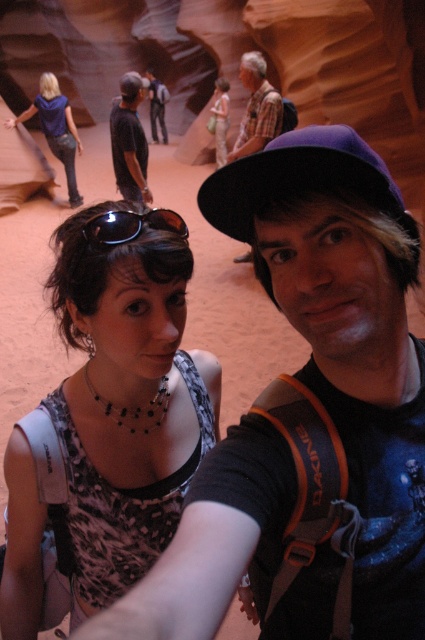
Question: Can you confirm if leopard print tank top at center is wider than matte blue shirt at upper left?

Choices:
 (A) yes
 (B) no

Answer: (B)

Question: Which point is farther from the camera taking this photo?

Choices:
 (A) (34, 513)
 (B) (139, 177)
 (C) (88, 232)

Answer: (B)

Question: Can you confirm if matte black hat at center is positioned to the left of denim jeans at center?

Choices:
 (A) yes
 (B) no

Answer: (B)

Question: Which is farther from the light beige fabric dress at center?

Choices:
 (A) denim jeans at center
 (B) matte black hat at center

Answer: (B)

Question: Which point is closer to the camera?

Choices:
 (A) (277, 104)
 (B) (73, 189)
 (C) (226, 83)

Answer: (A)

Question: Can you confirm if matte black hat at center is positioned to the right of light beige fabric dress at center?

Choices:
 (A) yes
 (B) no

Answer: (A)